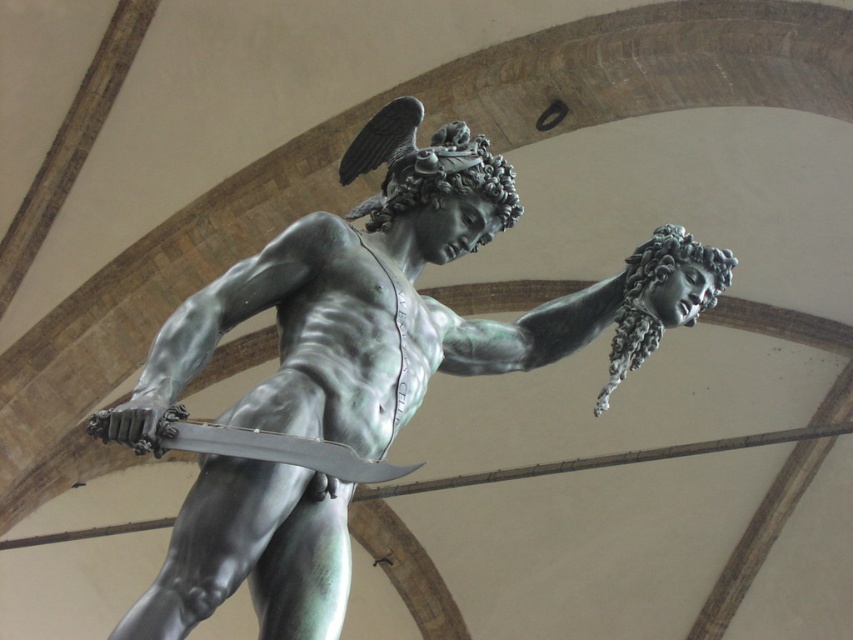
Does green patina bronze statue at center have a greater width compared to polished bronze sword at center?

Yes, green patina bronze statue at center is wider than polished bronze sword at center.

From the picture: Which is more to the right, green patina bronze statue at center or polished bronze sword at center?

Positioned to the right is green patina bronze statue at center.

I want to click on green patina bronze statue at center, so click(402, 300).